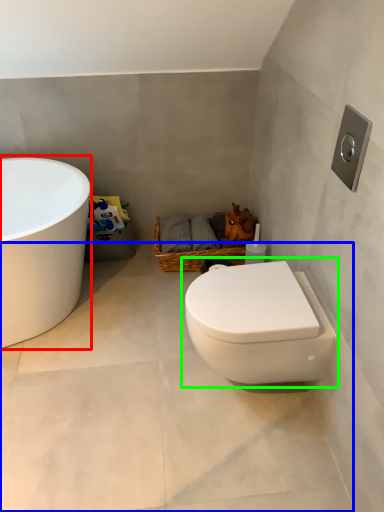
Question: Based on their relative distances, which object is nearer to bathtub (highlighted by a red box)? Choose from concrete (highlighted by a blue box) and toilet (highlighted by a green box).

Choices:
 (A) concrete
 (B) toilet

Answer: (A)